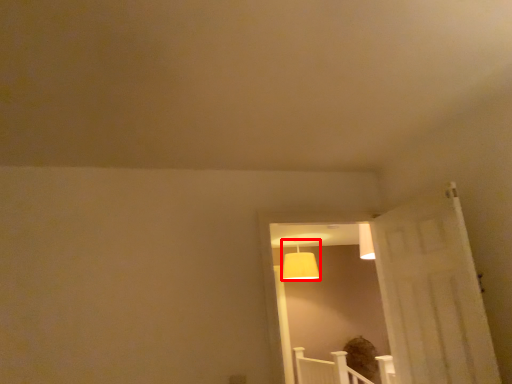
Question: From the image's perspective, where is lamp (annotated by the red box) located relative to window?

Choices:
 (A) below
 (B) above

Answer: (A)